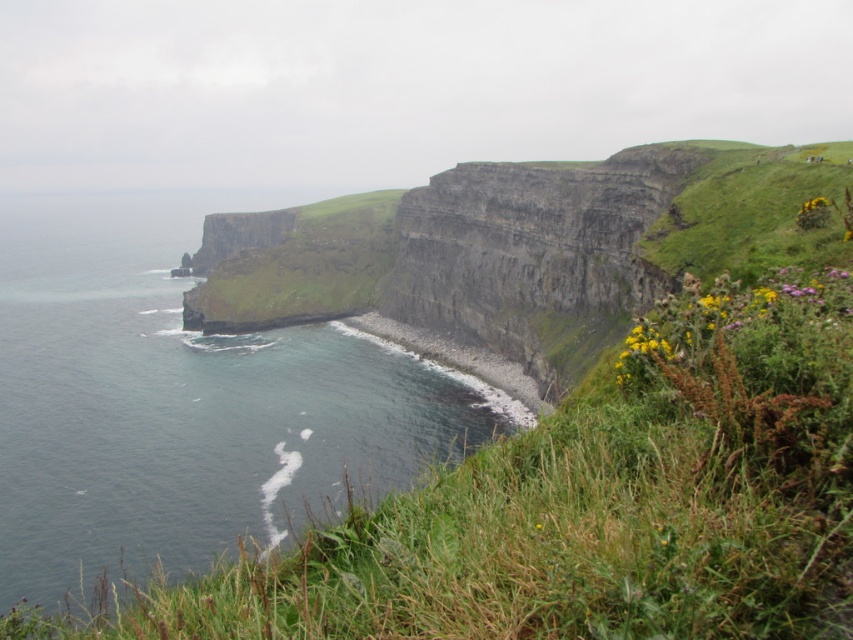
Question: Among these objects, which one is nearest to the camera?

Choices:
 (A) dark blue water at left
 (B) gray rocky shoreline at lower left

Answer: (A)

Question: Can you confirm if dark blue water at left is positioned above gray rocky shoreline at lower left?

Choices:
 (A) yes
 (B) no

Answer: (A)

Question: Is dark blue water at left positioned in front of gray rocky shoreline at lower left?

Choices:
 (A) no
 (B) yes

Answer: (B)

Question: Can you confirm if dark blue water at left is thinner than gray rocky shoreline at lower left?

Choices:
 (A) yes
 (B) no

Answer: (B)